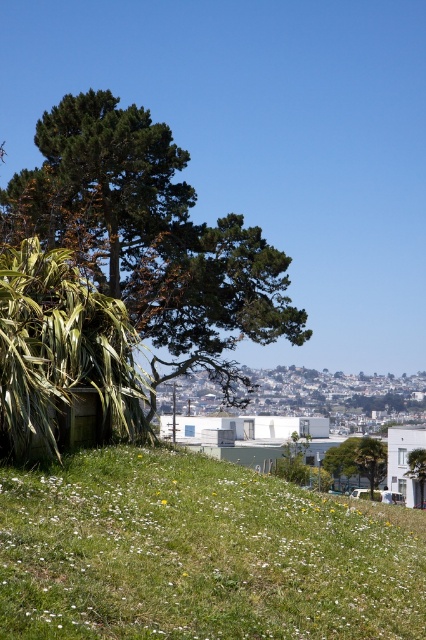
You are standing in the scene and want to walk from the green grassy hillside at lower left to the green leafy tree at center. Which direction should you move to get closer to the tree?

To get closer to the green leafy tree at center, you should move away from the green grassy hillside at lower left since it is closer to the viewer than the tree.

You are a landscape architect designing a walking path that must pass between the green grassy hillside at lower left and the green leafy tree at center. Based on their positions, which side of the path should be closer to the tree to avoid encroaching on the hillside?

The green grassy hillside at lower left is positioned over the green leafy tree at center, meaning the tree is behind the hillside from the viewer. To avoid encroaching on the hillside, the path should be closer to the tree side since the hillside is elevated above the tree area.